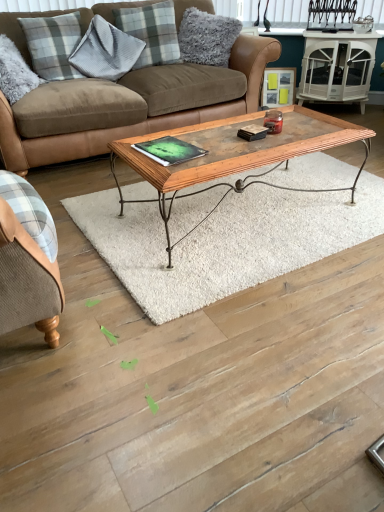
Question: From a real-world perspective, is matte wooden picture frame at upper right physically above gray plaid pillow at upper left, the 4th pillow viewed from the right?

Choices:
 (A) no
 (B) yes

Answer: (A)

Question: Is matte wooden picture frame at upper right smaller than gray plaid pillow at upper left, the 4th pillow viewed from the right?

Choices:
 (A) yes
 (B) no

Answer: (A)

Question: Would you say matte wooden picture frame at upper right is a long distance from gray plaid pillow at upper left, positioned as the first pillow in left-to-right order?

Choices:
 (A) yes
 (B) no

Answer: (A)

Question: Is matte wooden picture frame at upper right bigger than gray plaid pillow at upper left, the 4th pillow viewed from the right?

Choices:
 (A) no
 (B) yes

Answer: (A)

Question: From a real-world perspective, is matte wooden picture frame at upper right physically below gray plaid pillow at upper left, the 4th pillow viewed from the right?

Choices:
 (A) no
 (B) yes

Answer: (B)

Question: Can you confirm if matte wooden picture frame at upper right is positioned to the left of gray plaid pillow at upper left, positioned as the first pillow in left-to-right order?

Choices:
 (A) no
 (B) yes

Answer: (A)

Question: Is white glossy side table at upper right behind gray plaid pillow at upper left, positioned as the first pillow in left-to-right order?

Choices:
 (A) no
 (B) yes

Answer: (B)

Question: Is white glossy side table at upper right facing towards gray plaid pillow at upper left, the 4th pillow viewed from the right?

Choices:
 (A) yes
 (B) no

Answer: (B)

Question: Is white glossy side table at upper right positioned beyond the bounds of gray plaid pillow at upper left, the 4th pillow viewed from the right?

Choices:
 (A) no
 (B) yes

Answer: (B)

Question: Does white glossy side table at upper right have a smaller size compared to gray plaid pillow at upper left, the 4th pillow viewed from the right?

Choices:
 (A) yes
 (B) no

Answer: (B)

Question: Does white glossy side table at upper right appear on the right side of gray plaid pillow at upper left, the 4th pillow viewed from the right?

Choices:
 (A) no
 (B) yes

Answer: (B)

Question: Is white glossy side table at upper right placed right next to gray plaid pillow at upper left, the 4th pillow viewed from the right?

Choices:
 (A) no
 (B) yes

Answer: (A)

Question: Considering the relative sizes of brown leather couch at center and matte wooden picture frame at upper right in the image provided, is brown leather couch at center shorter than matte wooden picture frame at upper right?

Choices:
 (A) no
 (B) yes

Answer: (A)